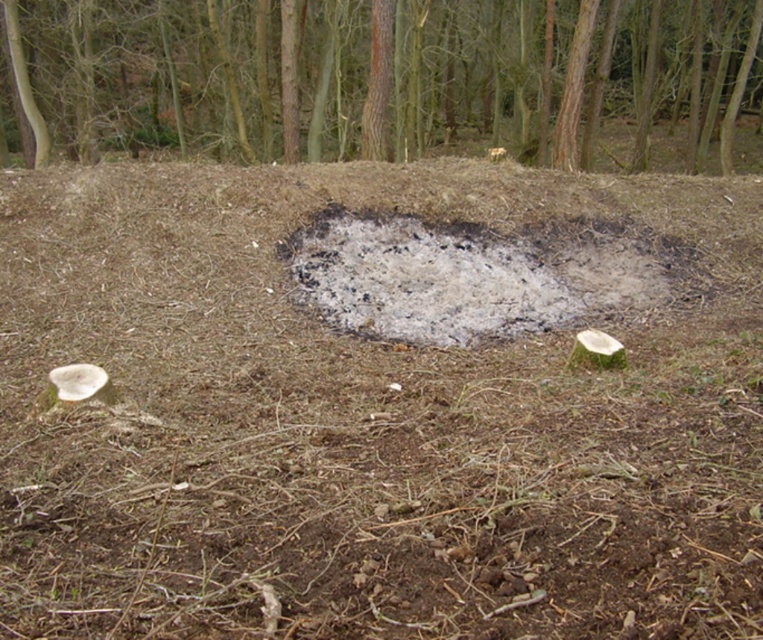
Who is lower down, brown wood tree at upper center or ashy gray ash at center?

Positioned lower is ashy gray ash at center.

Is brown wood tree at upper center positioned at the back of ashy gray ash at center?

Yes, it is behind ashy gray ash at center.

Is point (601, 148) farther from viewer compared to point (638, 296)?

That is True.

At what (x,y) coordinates should I click in order to perform the action: click on brown wood tree at upper center. Please return your answer as a coordinate pair (x, y). This screenshot has height=640, width=763. Looking at the image, I should click on (380, 77).